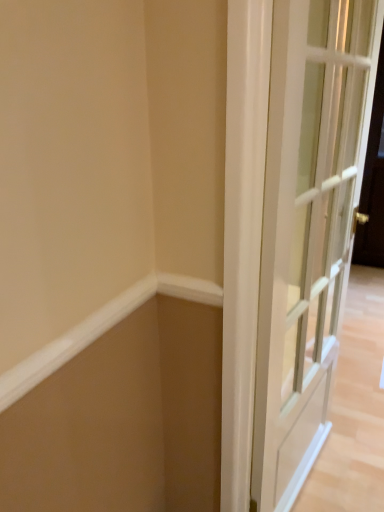
Question: Should I look upward or downward to see white glass door at right?

Choices:
 (A) down
 (B) up

Answer: (A)